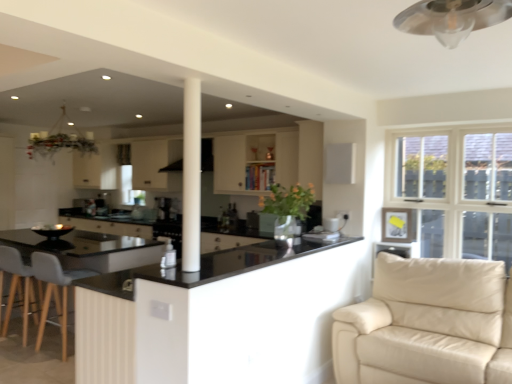
Question: Can you confirm if black glossy countertop at center, which is the second countertop from bottom to top, is thinner than white fabric curtain at upper center?

Choices:
 (A) yes
 (B) no

Answer: (B)

Question: Can you confirm if black glossy countertop at center, the 1th countertop viewed from the top, is taller than white fabric curtain at upper center?

Choices:
 (A) no
 (B) yes

Answer: (A)

Question: Is black glossy countertop at center, the 1th countertop viewed from the top, closer to camera compared to white fabric curtain at upper center?

Choices:
 (A) yes
 (B) no

Answer: (A)

Question: Is black glossy countertop at center, which is the second countertop from bottom to top, smaller than white fabric curtain at upper center?

Choices:
 (A) no
 (B) yes

Answer: (A)

Question: Could you tell me if black glossy countertop at center, the 1th countertop viewed from the top, is turned towards white fabric curtain at upper center?

Choices:
 (A) no
 (B) yes

Answer: (A)

Question: In terms of height, does black glossy countertop at center, which is counted as the second countertop, starting from the top, look taller or shorter compared to white smooth column at center?

Choices:
 (A) short
 (B) tall

Answer: (A)

Question: Considering the positions of black glossy countertop at center, which is the 1th countertop from bottom to top, and white smooth column at center in the image, is black glossy countertop at center, which is the 1th countertop from bottom to top, wider or thinner than white smooth column at center?

Choices:
 (A) thin
 (B) wide

Answer: (B)

Question: Based on their positions, is black glossy countertop at center, which is counted as the second countertop, starting from the top, located to the left or right of white smooth column at center?

Choices:
 (A) right
 (B) left

Answer: (A)

Question: Based on their sizes in the image, would you say black glossy countertop at center, which is the 1th countertop from bottom to top, is bigger or smaller than white smooth column at center?

Choices:
 (A) big
 (B) small

Answer: (A)

Question: In terms of size, does gray fabric swivel chair at lower left appear bigger or smaller than satin black coffee machine at center?

Choices:
 (A) small
 (B) big

Answer: (B)

Question: Is gray fabric swivel chair at lower left to the left or to the right of satin black coffee machine at center in the image?

Choices:
 (A) right
 (B) left

Answer: (B)

Question: Is gray fabric swivel chair at lower left taller or shorter than satin black coffee machine at center?

Choices:
 (A) short
 (B) tall

Answer: (B)

Question: In terms of width, does gray fabric swivel chair at lower left look wider or thinner when compared to satin black coffee machine at center?

Choices:
 (A) wide
 (B) thin

Answer: (A)

Question: Considering the positions of point (125, 147) and point (483, 279), is point (125, 147) closer or farther from the camera than point (483, 279)?

Choices:
 (A) farther
 (B) closer

Answer: (A)

Question: From the image's perspective, is white fabric curtain at upper center located above or below beige leather couch at lower right?

Choices:
 (A) below
 (B) above

Answer: (B)